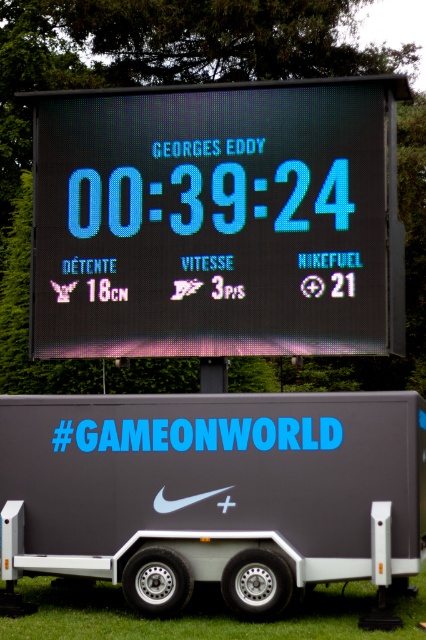
Can you confirm if black led scoreboard at center is positioned to the right of matte gray trailer at center?

Incorrect, black led scoreboard at center is not on the right side of matte gray trailer at center.

Between point (388, 250) and point (244, 432), which one is positioned in front?

Point (244, 432) is more forward.

Locate an element on the screen. black led scoreboard at center is located at coordinates (218, 220).